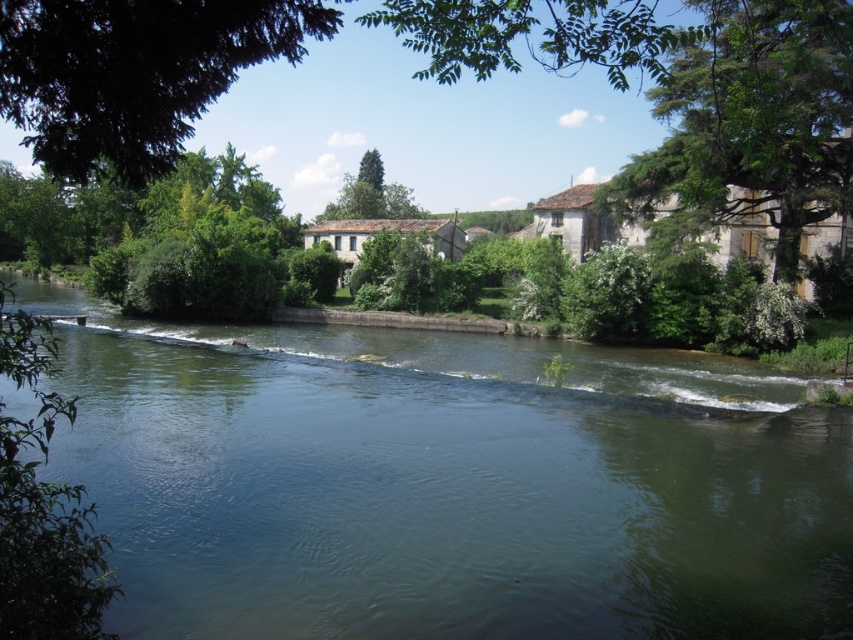
Is point (749, 161) more distant than point (370, 176)?

No, it is in front of (370, 176).

Is green leafy tree at upper right bigger than green leafy tree at center?

Correct, green leafy tree at upper right is larger in size than green leafy tree at center.

Identify the location of green leafy tree at upper right. The height and width of the screenshot is (640, 853). (751, 124).

Describe the element at coordinates (445, 484) in the screenshot. This screenshot has height=640, width=853. I see `green water at center` at that location.

Image resolution: width=853 pixels, height=640 pixels. Identify the location of green water at center. (445, 484).

Is green leafy tree at upper left closer to camera compared to green leafy tree at center?

That is True.

Is green leafy tree at upper left taller than green leafy tree at center?

Yes.

Locate an element on the screen. The width and height of the screenshot is (853, 640). green leafy tree at upper left is located at coordinates (135, 72).